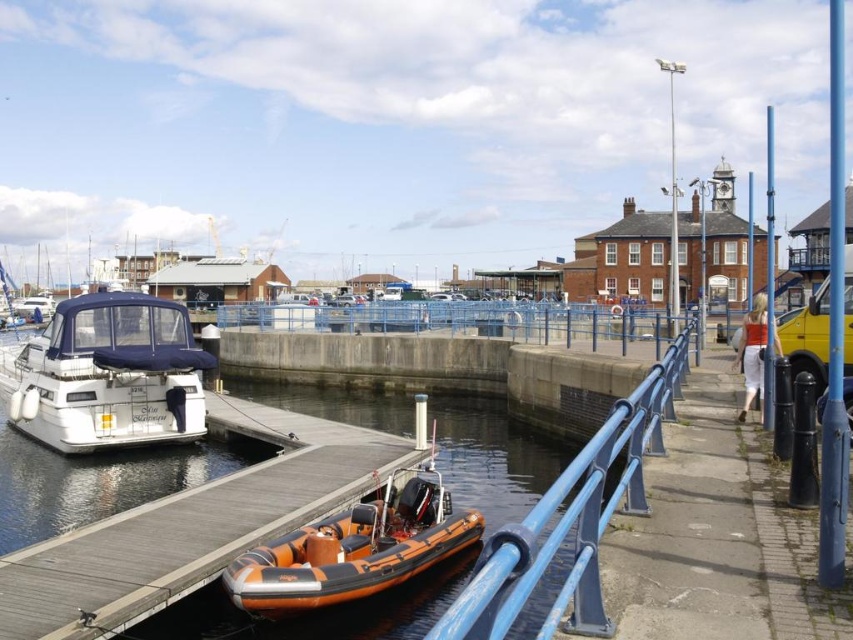
You are standing on the wooden pier in the marina scene and see a point marked at coordinates [572,520]. What object is this point located on?

The point at coordinates [572,520] is located on the blue metallic rail at center.

You are standing at the center of the marina and want to locate the white matte boat at left. According to the coordinates provided, in which direction should you look to find it?

The white matte boat at left is located at coordinates 0.588 on the x axis and 0.127 on the y axis. Since the x value is greater than 0.5, it means the boat is positioned to the right side of the image. Therefore, you should look to your right to find the white matte boat at left.